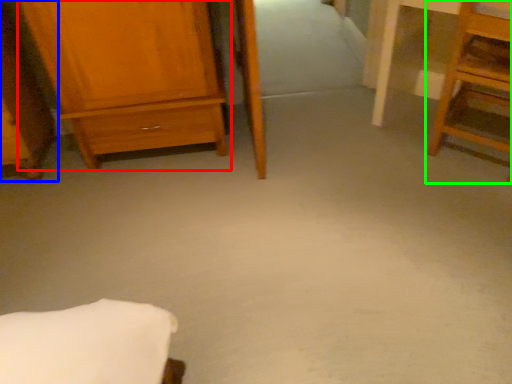
Question: Which object is the farthest from chest of drawers (highlighted by a red box)? Choose among these: furniture (highlighted by a blue box) or furniture (highlighted by a green box).

Choices:
 (A) furniture
 (B) furniture

Answer: (B)